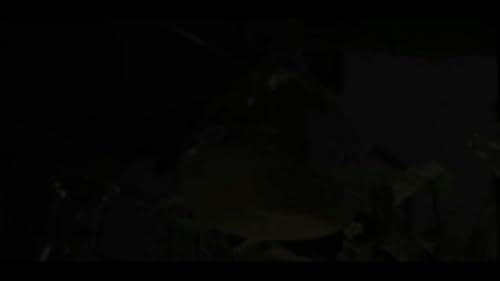
Where is `white tissue`? The height and width of the screenshot is (281, 500). white tissue is located at coordinates (421, 182).